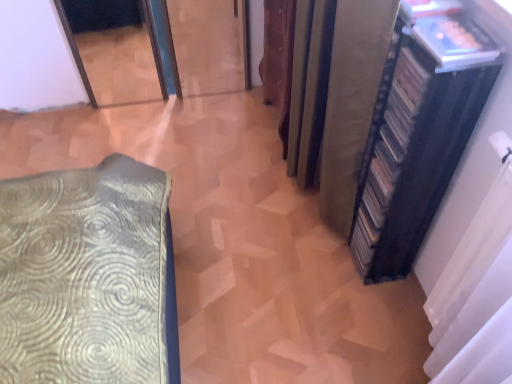
Question: Is silky beige curtain at right, placed as the 2th curtain when sorted from right to left, to the left of black matte bookshelf at right from the viewer's perspective?

Choices:
 (A) no
 (B) yes

Answer: (B)

Question: Does silky beige curtain at right, placed as the 2th curtain when sorted from right to left, come in front of black matte bookshelf at right?

Choices:
 (A) yes
 (B) no

Answer: (B)

Question: Is silky beige curtain at right, placed as the 2th curtain when sorted from right to left, positioned with its back to black matte bookshelf at right?

Choices:
 (A) yes
 (B) no

Answer: (B)

Question: From the image's perspective, would you say silky beige curtain at right, marked as the first curtain in a left-to-right arrangement, is positioned over black matte bookshelf at right?

Choices:
 (A) yes
 (B) no

Answer: (A)

Question: Is silky beige curtain at right, placed as the 2th curtain when sorted from right to left, smaller than black matte bookshelf at right?

Choices:
 (A) no
 (B) yes

Answer: (A)

Question: Are silky beige curtain at right, placed as the 2th curtain when sorted from right to left, and black matte bookshelf at right located far from each other?

Choices:
 (A) no
 (B) yes

Answer: (A)

Question: Is black matte curtain at right, which appears as the first curtain when viewed from the right, shorter than silky beige curtain at right, placed as the 2th curtain when sorted from right to left?

Choices:
 (A) yes
 (B) no

Answer: (A)

Question: Is black matte curtain at right, which appears as the first curtain when viewed from the right, closer to the viewer compared to silky beige curtain at right, placed as the 2th curtain when sorted from right to left?

Choices:
 (A) no
 (B) yes

Answer: (B)

Question: From the image's perspective, is black matte curtain at right, which appears as the first curtain when viewed from the right, over silky beige curtain at right, placed as the 2th curtain when sorted from right to left?

Choices:
 (A) no
 (B) yes

Answer: (A)

Question: Can you see black matte curtain at right, which ranks as the second curtain in left-to-right order, touching silky beige curtain at right, placed as the 2th curtain when sorted from right to left?

Choices:
 (A) yes
 (B) no

Answer: (B)

Question: From a real-world perspective, does black matte curtain at right, which ranks as the second curtain in left-to-right order, sit lower than silky beige curtain at right, placed as the 2th curtain when sorted from right to left?

Choices:
 (A) no
 (B) yes

Answer: (B)

Question: Could you tell me if black matte curtain at right, which appears as the first curtain when viewed from the right, is turned towards silky beige curtain at right, placed as the 2th curtain when sorted from right to left?

Choices:
 (A) no
 (B) yes

Answer: (A)

Question: Does black matte bookshelf at right appear on the right side of black matte curtain at right, which appears as the first curtain when viewed from the right?

Choices:
 (A) no
 (B) yes

Answer: (A)